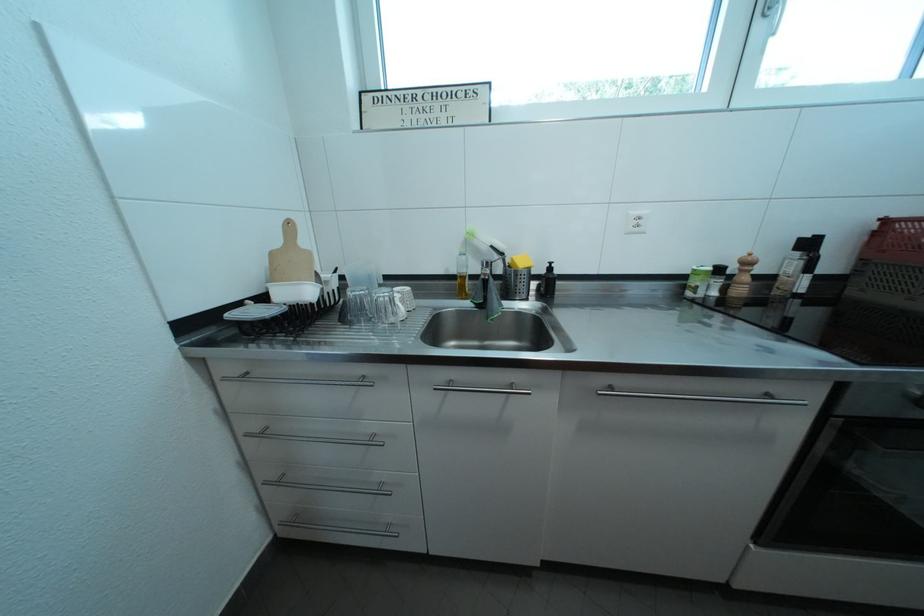
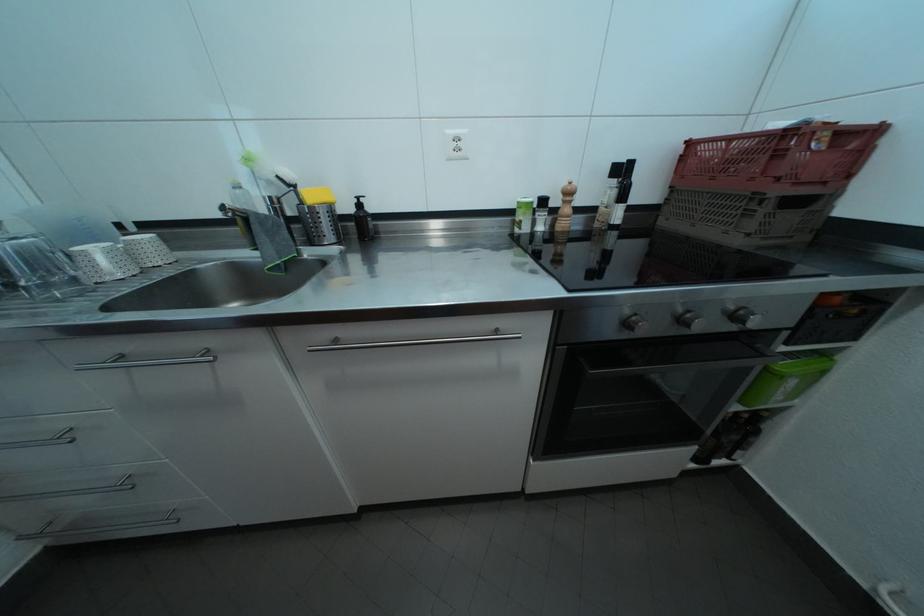
Find the pixel in the second image that matches (621,392) in the first image.

(346, 347)